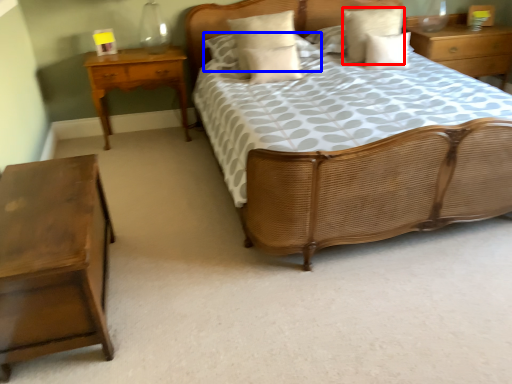
Question: Which point is further to the camera, pillow (highlighted by a red box) or pillow (highlighted by a blue box)?

Choices:
 (A) pillow
 (B) pillow

Answer: (B)